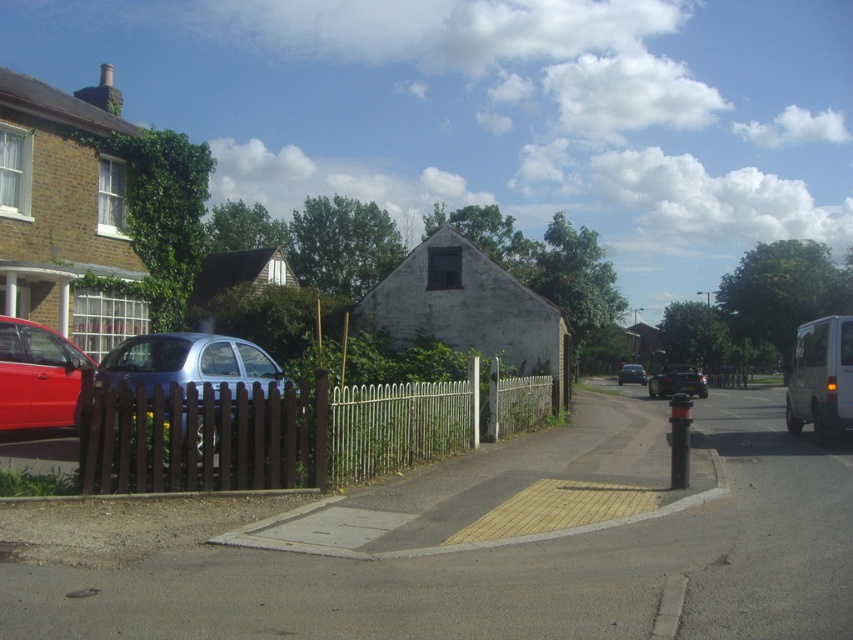
Question: Which of the following is the closest to the observer?

Choices:
 (A) shiny red car at left
 (B) shiny black car at center
 (C) metallic silver van at right

Answer: (A)

Question: Can you confirm if brown wooden fence at center is bigger than shiny red car at left?

Choices:
 (A) no
 (B) yes

Answer: (B)

Question: Which point appears closest to the camera in this image?

Choices:
 (A) (695, 376)
 (B) (642, 368)
 (C) (224, 348)
 (D) (86, 436)

Answer: (D)

Question: Does satin blue car at left appear over shiny black car at center?

Choices:
 (A) no
 (B) yes

Answer: (B)

Question: Which object is closer to the camera taking this photo?

Choices:
 (A) satin blue car at left
 (B) shiny red car at left

Answer: (A)

Question: Is satin blue car at left wider than shiny black car at center?

Choices:
 (A) yes
 (B) no

Answer: (B)